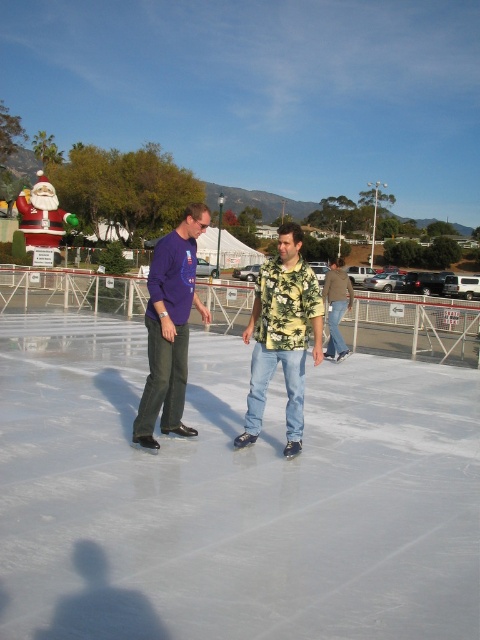
You are an ice skater preparing to glide across the white smooth ice at center and the matte purple shirt at center. Which surface would provide a smoother glide? Please explain your reasoning based on the scene description.

The white smooth ice at center is smoother than the matte purple shirt at center because the description specifies that the ice is smooth, while the shirt is matte, which typically has a less slippery surface.

You are standing at the edge of the ice rink and want to move towards the two points marked in the image. Which point, point (265, 300) or point (164, 362), will you reach first?

Point (265, 300) is closer to the viewer than point (164, 362), so you will reach point (265, 300) first.